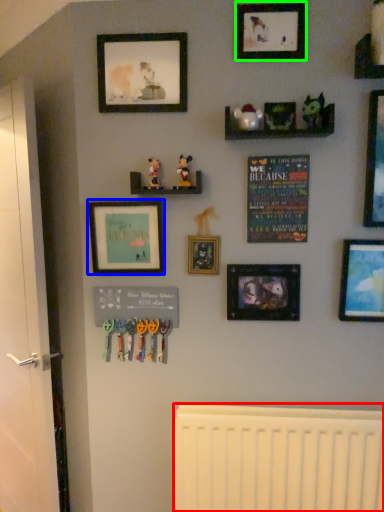
Question: Considering the real-world distances, which object is farthest from radiator (highlighted by a red box)? picture frame (highlighted by a blue box) or picture frame (highlighted by a green box)?

Choices:
 (A) picture frame
 (B) picture frame

Answer: (B)